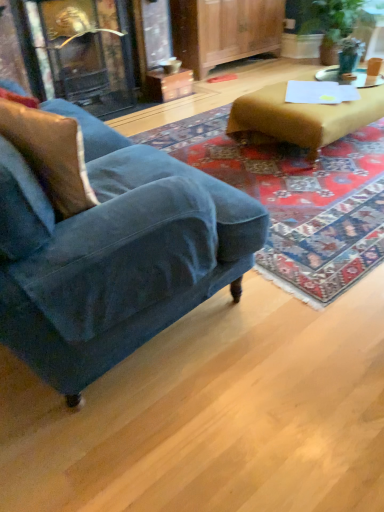
Question: Is velvet blue couch at lower left thinner than velvet blue armchair at left?

Choices:
 (A) no
 (B) yes

Answer: (B)

Question: Can you confirm if velvet blue couch at lower left is bigger than velvet blue armchair at left?

Choices:
 (A) yes
 (B) no

Answer: (A)

Question: Does velvet blue couch at lower left come behind velvet blue armchair at left?

Choices:
 (A) no
 (B) yes

Answer: (A)

Question: Are velvet blue couch at lower left and velvet blue armchair at left far apart?

Choices:
 (A) no
 (B) yes

Answer: (A)

Question: Is the depth of velvet blue couch at lower left less than that of velvet blue armchair at left?

Choices:
 (A) no
 (B) yes

Answer: (B)

Question: Does velvet blue couch at lower left have a lesser height compared to velvet blue armchair at left?

Choices:
 (A) yes
 (B) no

Answer: (B)

Question: Is white glossy side table at upper right positioned with its back to velvet brown pillow at left?

Choices:
 (A) no
 (B) yes

Answer: (A)

Question: Would you say white glossy side table at upper right is outside velvet brown pillow at left?

Choices:
 (A) yes
 (B) no

Answer: (A)

Question: Is white glossy side table at upper right placed right next to velvet brown pillow at left?

Choices:
 (A) no
 (B) yes

Answer: (A)

Question: Is white glossy side table at upper right further to the viewer compared to velvet brown pillow at left?

Choices:
 (A) no
 (B) yes

Answer: (B)

Question: Does white glossy side table at upper right have a smaller size compared to velvet brown pillow at left?

Choices:
 (A) yes
 (B) no

Answer: (A)

Question: Does white glossy side table at upper right have a lesser height compared to velvet brown pillow at left?

Choices:
 (A) no
 (B) yes

Answer: (B)

Question: Is teal glass at upper right aimed at velvet brown pillow at left?

Choices:
 (A) no
 (B) yes

Answer: (A)